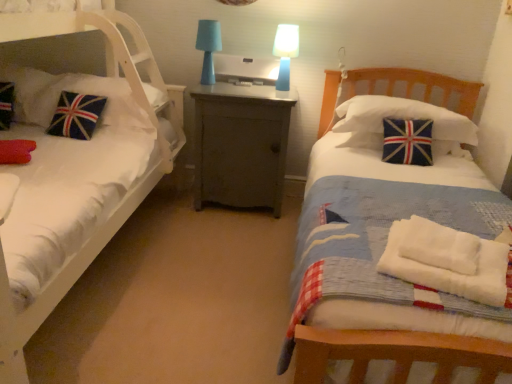
Question: Does blue plastic table lamp at upper center, marked as the first table lamp in a right-to-left arrangement, have a lesser height compared to white cotton towels at lower right?

Choices:
 (A) no
 (B) yes

Answer: (A)

Question: Is blue plastic table lamp at upper center, marked as the first table lamp in a right-to-left arrangement, not inside white cotton towels at lower right?

Choices:
 (A) yes
 (B) no

Answer: (A)

Question: Is blue plastic table lamp at upper center, marked as the first table lamp in a right-to-left arrangement, facing away from white cotton towels at lower right?

Choices:
 (A) no
 (B) yes

Answer: (A)

Question: Is blue plastic table lamp at upper center, acting as the second table lamp starting from the left, closer to the viewer compared to white cotton towels at lower right?

Choices:
 (A) no
 (B) yes

Answer: (A)

Question: From a real-world perspective, is blue plastic table lamp at upper center, acting as the second table lamp starting from the left, under white cotton towels at lower right?

Choices:
 (A) yes
 (B) no

Answer: (B)

Question: In terms of height, does blue fabric pillow at right, the third pillow in the left-to-right sequence, look taller or shorter compared to blue plastic table lamp at upper center, marked as the first table lamp in a right-to-left arrangement?

Choices:
 (A) short
 (B) tall

Answer: (A)

Question: Is blue fabric pillow at right, marked as the first pillow in a right-to-left arrangement, bigger or smaller than blue plastic table lamp at upper center, marked as the first table lamp in a right-to-left arrangement?

Choices:
 (A) small
 (B) big

Answer: (B)

Question: In the image, is blue fabric pillow at right, marked as the first pillow in a right-to-left arrangement, positioned in front of or behind blue plastic table lamp at upper center, marked as the first table lamp in a right-to-left arrangement?

Choices:
 (A) behind
 (B) front

Answer: (B)

Question: From the image's perspective, is blue fabric pillow at right, marked as the first pillow in a right-to-left arrangement, positioned above or below blue plastic table lamp at upper center, acting as the second table lamp starting from the left?

Choices:
 (A) below
 (B) above

Answer: (A)

Question: Is velvet union jack pillow at left, which ranks as the 2th pillow in left-to-right order, inside the boundaries of union jack fabric pillow at left, the 1th pillow in the left-to-right sequence, or outside?

Choices:
 (A) inside
 (B) outside

Answer: (B)

Question: Visually, is velvet union jack pillow at left, which ranks as the 2th pillow in left-to-right order, positioned to the left or to the right of union jack fabric pillow at left, positioned as the 3th pillow in right-to-left order?

Choices:
 (A) left
 (B) right

Answer: (B)

Question: From a real-world perspective, is velvet union jack pillow at left, which ranks as the 2th pillow in left-to-right order, physically located above or below union jack fabric pillow at left, positioned as the 3th pillow in right-to-left order?

Choices:
 (A) below
 (B) above

Answer: (A)

Question: From the image's perspective, is velvet union jack pillow at left, which ranks as the 2th pillow in left-to-right order, above or below union jack fabric pillow at left, the 1th pillow in the left-to-right sequence?

Choices:
 (A) above
 (B) below

Answer: (B)

Question: Looking at their shapes, would you say blue fabric lampshade at center, which is counted as the second table lamp, starting from the right, is wider or thinner than union jack fabric pillow at left, positioned as the 3th pillow in right-to-left order?

Choices:
 (A) thin
 (B) wide

Answer: (A)

Question: Is blue fabric lampshade at center, arranged as the first table lamp when viewed from the left, in front of or behind union jack fabric pillow at left, the 1th pillow in the left-to-right sequence, in the image?

Choices:
 (A) front
 (B) behind

Answer: (B)